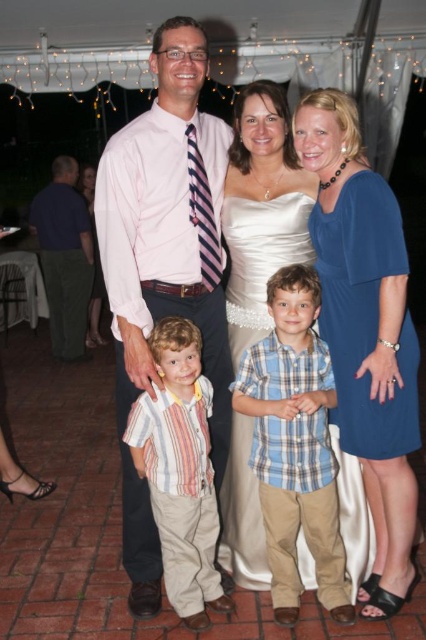
You are a photographer at the event and want to focus your camera on the pink shirt at center and the satin dress at center. Which one should you adjust the focus for first if you want to capture both clearly in the same shot?

The pink shirt at center is closer to the viewer than the satin dress at center, so you should focus on the pink shirt at center first to ensure both are in focus.

You are a photographer at the event and need to adjust the camera focus to capture both the blue jersey dress at right and the striped cotton shirt at center clearly. Given that the camera has a depth of field that can cover up to 30 inches, will both subjects be in focus?

The distance between the blue jersey dress at right and the striped cotton shirt at center is 30.10 inches, which exceeds the camera depth of field of 30 inches. Therefore, both subjects cannot be in focus simultaneously.

There are two people wearing blue satin dresses at center and another blue satin dress at center. How far apart are they?

The two people wearing blue satin dresses at center are 7.01 feet apart.